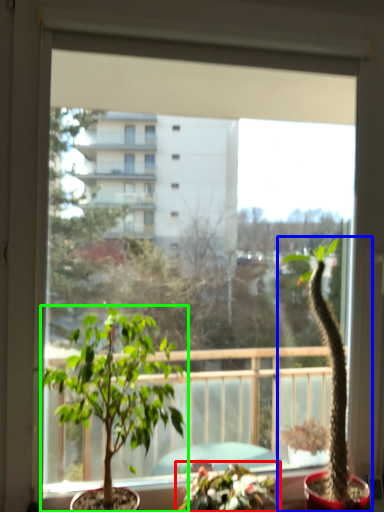
Question: Which is nearer to the houseplant (highlighted by a red box)? houseplant (highlighted by a blue box) or houseplant (highlighted by a green box).

Choices:
 (A) houseplant
 (B) houseplant

Answer: (A)